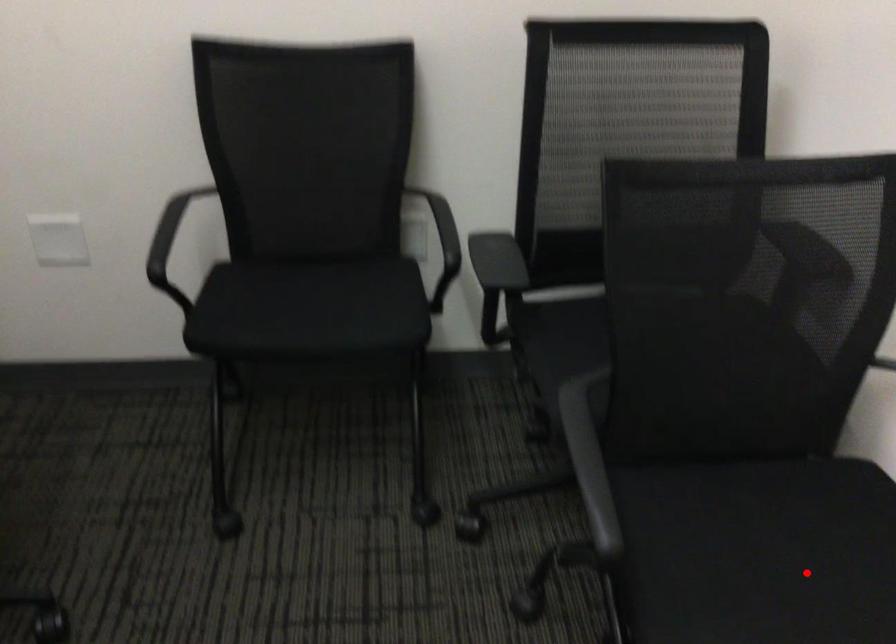
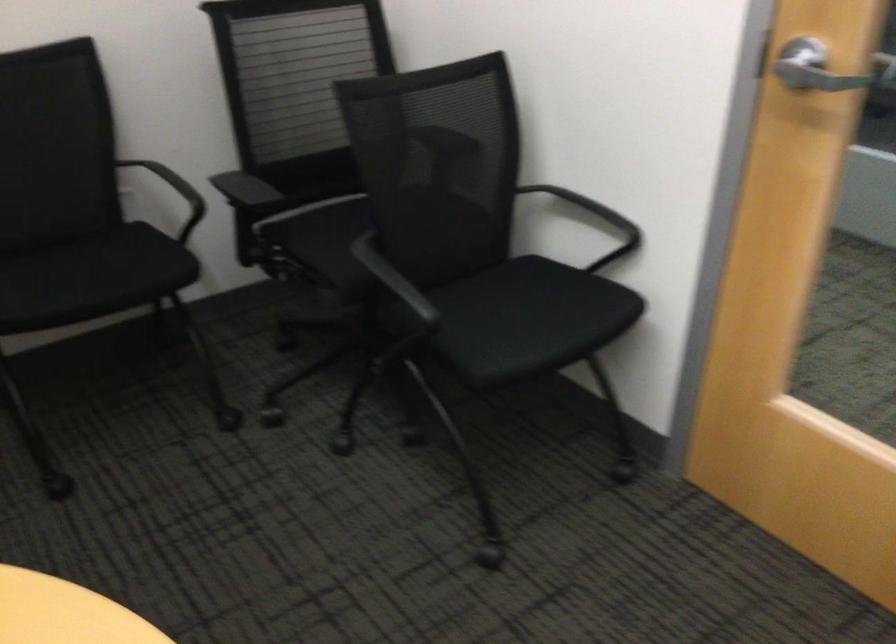
In the second image, find the point that corresponds to the highlighted location in the first image.

(528, 319)